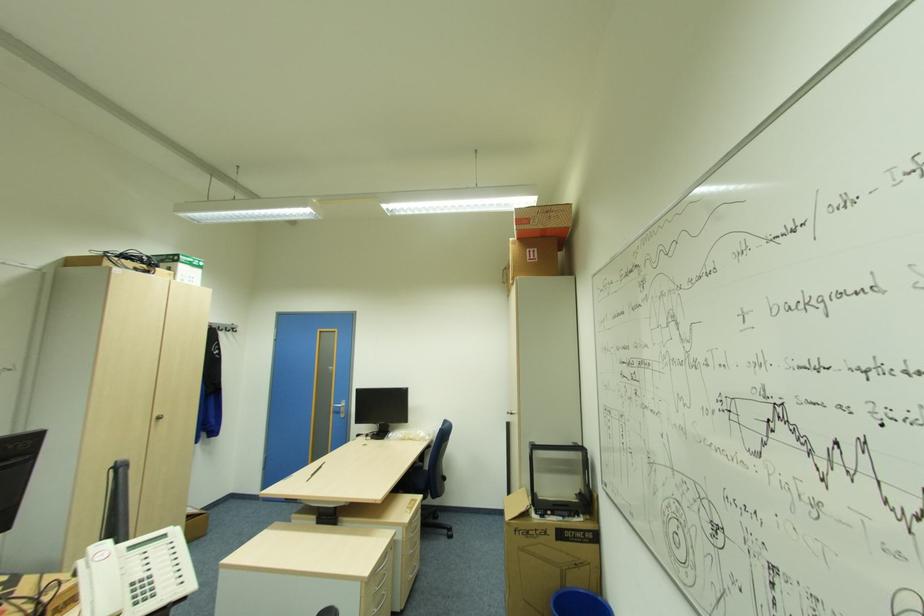
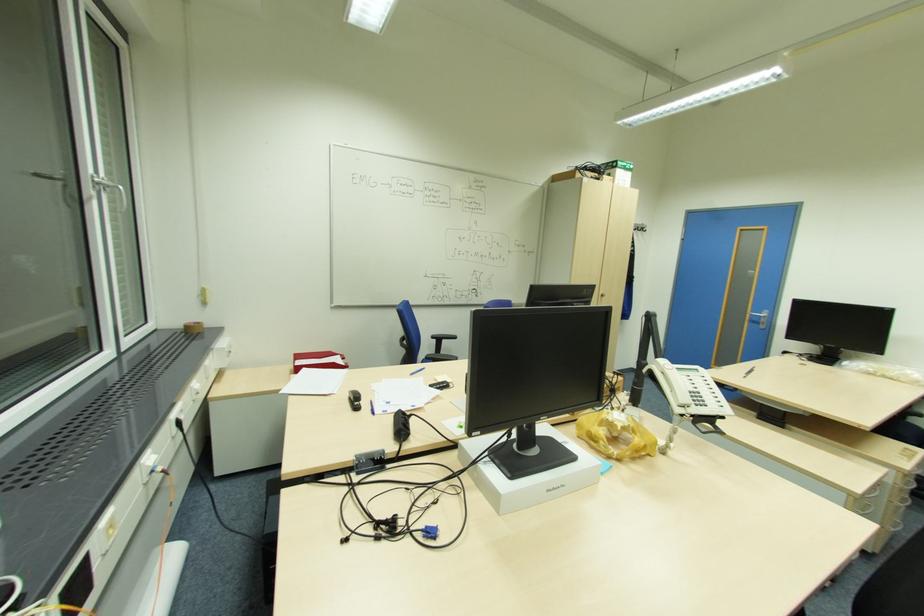
Question: The camera is either moving clockwise (left) or counter-clockwise (right) around the object. The first image is from the beginning of the video and the second image is from the end. Is the camera moving left or right when shooting the video?

Choices:
 (A) Left
 (B) Right

Answer: (B)